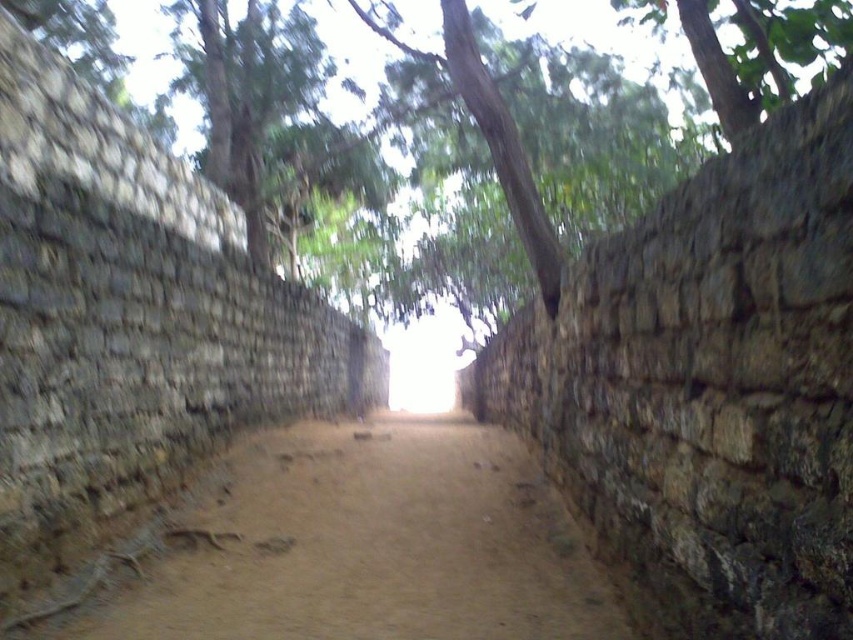
You are a hiker walking along the narrow pathway between the stone walls. You notice the brown sandy dirt track at center and the green leafy tree at upper center. Which one is closer to you?

The brown sandy dirt track at center is closer to you because it is shorter than the green leafy tree at upper center.

You are a hiker carrying a 2m wide tent. You need to walk along the brown sandy dirt track at center while avoiding the green leafy tree at upper center. Can your tent fit through the track without touching the tree?

The brown sandy dirt track at center is narrower than the green leafy tree at upper center, so the 2m wide tent may not fit through the track as the track is narrower than the tree, but the exact width isn